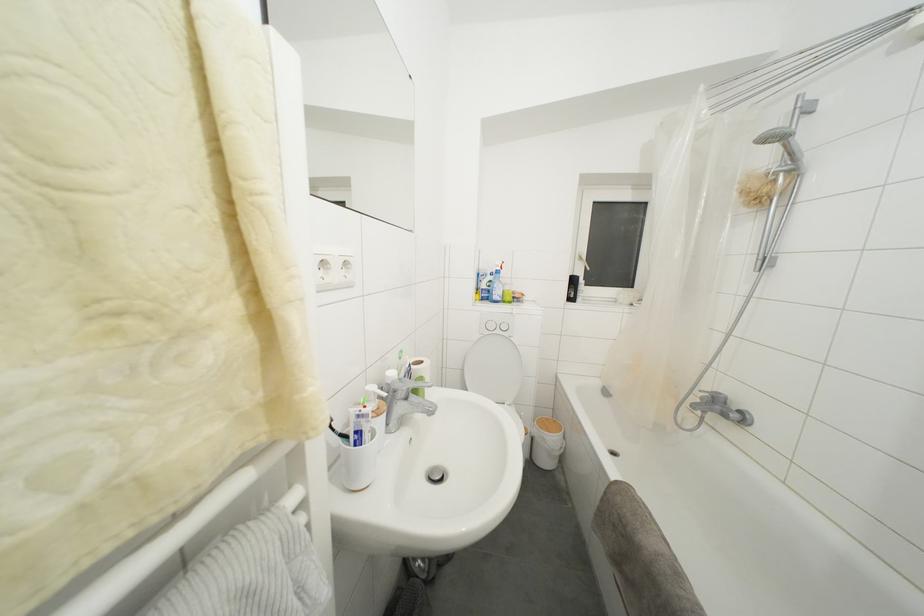
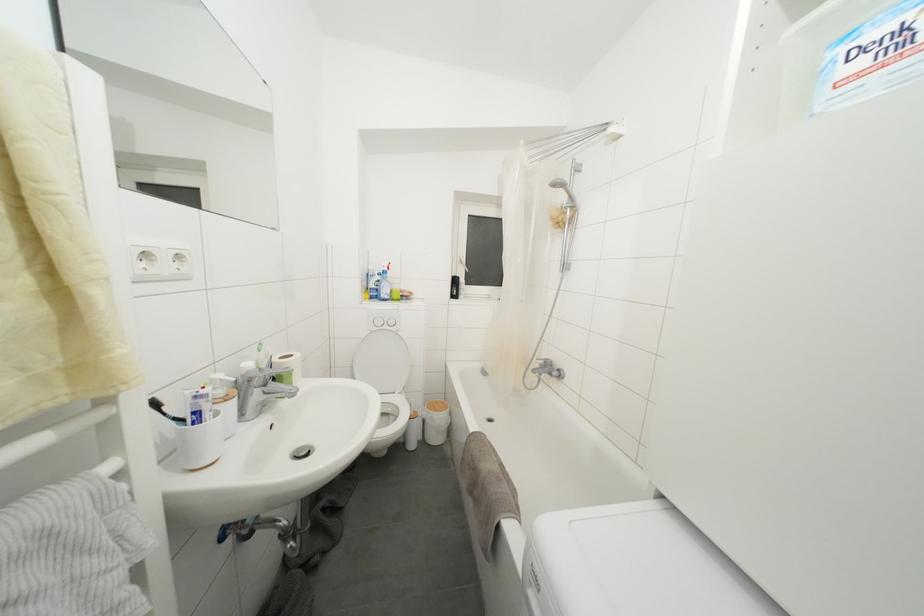
Find the pixel in the second image that matches (x=796, y=159) in the first image.

(575, 200)